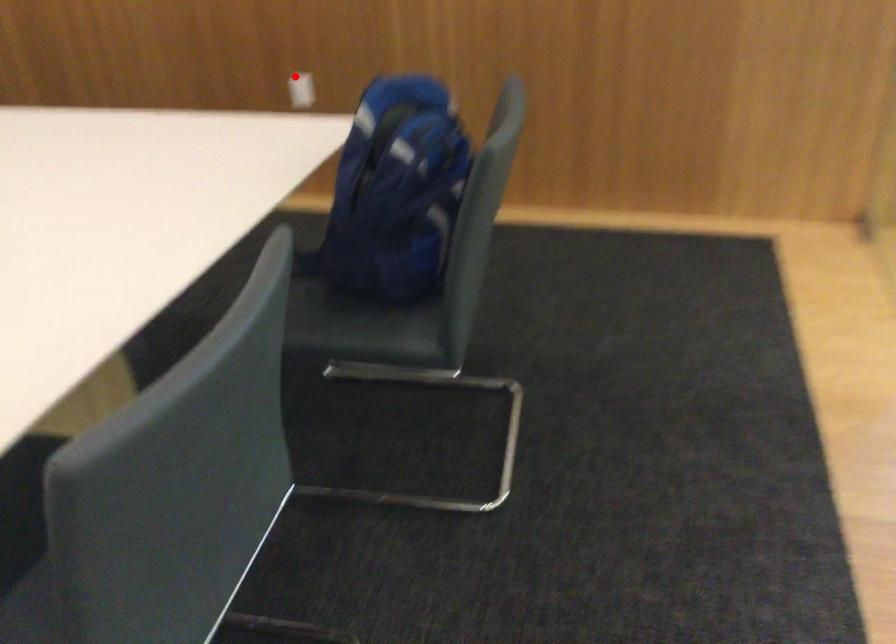
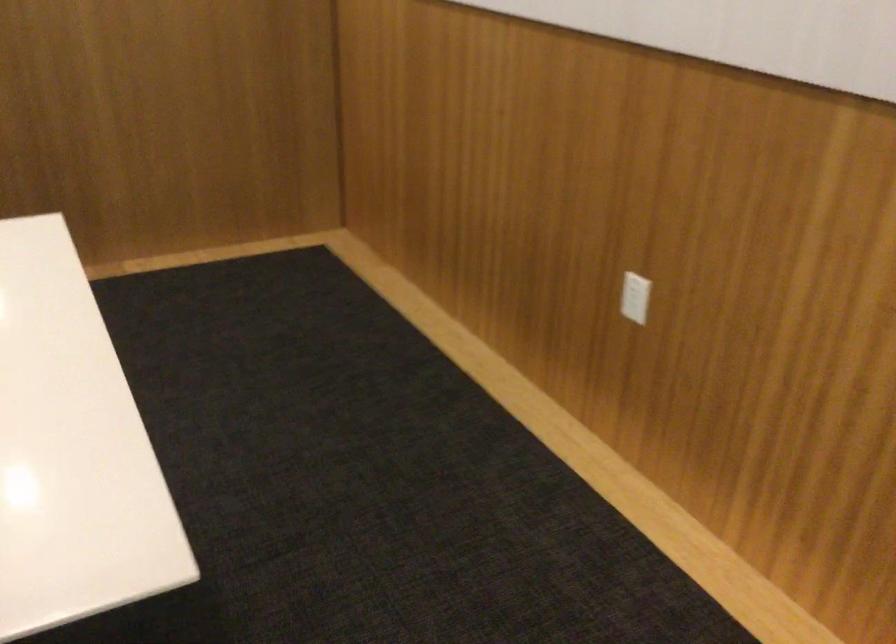
Find the pixel in the second image that matches the highlighted location in the first image.

(634, 297)